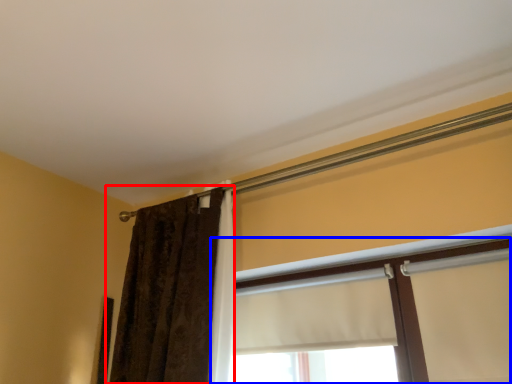
Question: Which point is closer to the camera, curtain (highlighted by a red box) or window (highlighted by a blue box)?

Choices:
 (A) curtain
 (B) window

Answer: (B)